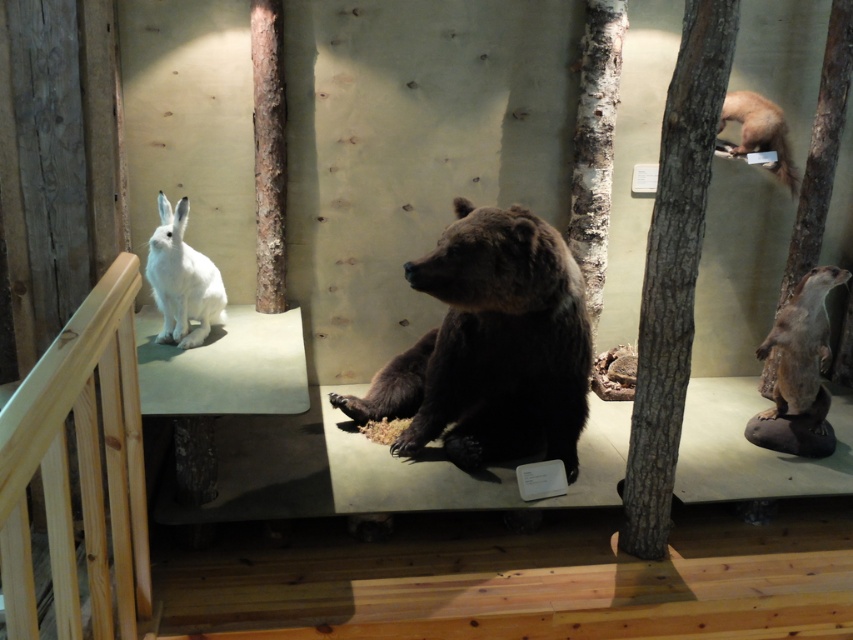
Question: Among these points, which one is farthest from the camera?

Choices:
 (A) (744, 141)
 (B) (805, 401)
 (C) (433, 284)

Answer: (A)

Question: In this image, where is white fur rabbit at left located relative to white fur rabbit at upper right?

Choices:
 (A) above
 (B) below

Answer: (B)

Question: Which of the following is the closest to the observer?

Choices:
 (A) (775, 125)
 (B) (183, 330)

Answer: (B)

Question: Observing the image, what is the correct spatial positioning of brown fur bear at center in reference to white fur rabbit at left?

Choices:
 (A) left
 (B) right

Answer: (B)

Question: Which of the following is the farthest from the observer?

Choices:
 (A) (556, 336)
 (B) (178, 257)

Answer: (B)

Question: In this image, where is brown fur bear at center located relative to white fur rabbit at upper right?

Choices:
 (A) right
 (B) left

Answer: (B)